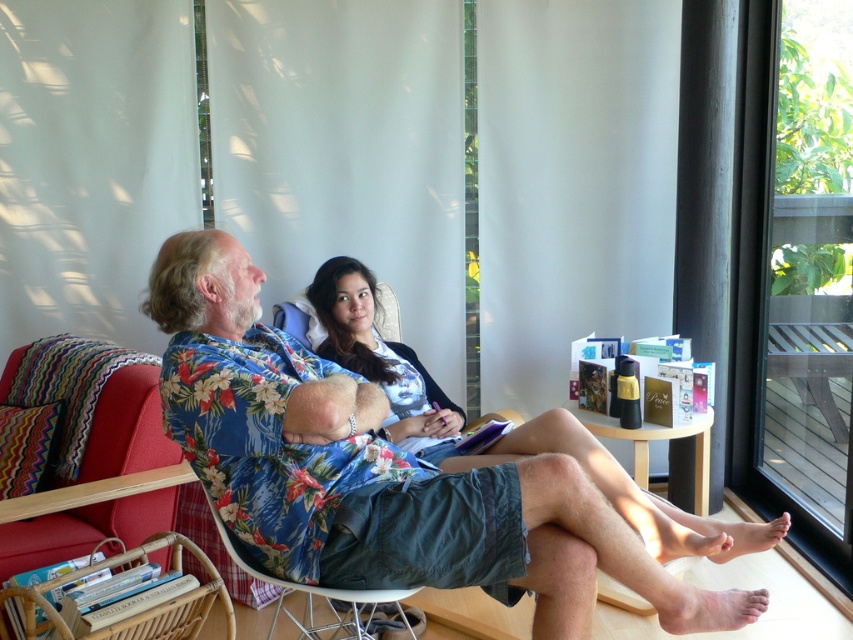
Does transparent glass door at right have a lesser height compared to matte floral shirt at center?

In fact, transparent glass door at right may be taller than matte floral shirt at center.

Does transparent glass door at right appear on the left side of matte floral shirt at center?

In fact, transparent glass door at right is to the right of matte floral shirt at center.

The image size is (853, 640). What do you see at coordinates (811, 266) in the screenshot?
I see `transparent glass door at right` at bounding box center [811, 266].

This screenshot has width=853, height=640. I want to click on transparent glass door at right, so click(x=811, y=266).